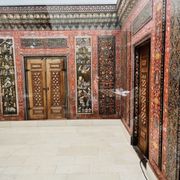
Identify the location of floor by doors. The image size is (180, 180). (48, 120), (137, 154).